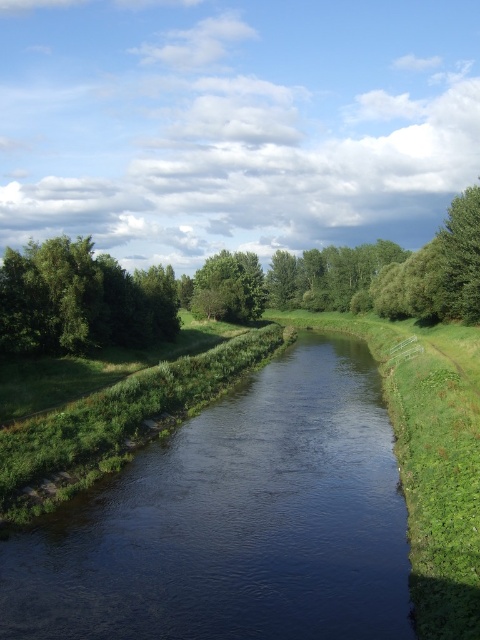
In the scene shown: Does dark water at center appear under green leafy tree at upper left?

Yes, dark water at center is below green leafy tree at upper left.

In the scene shown: Is dark water at center further to camera compared to green leafy tree at upper left?

No, it is not.

Locate an element on the screen. dark water at center is located at coordinates (235, 522).

Does green leafy tree at upper left appear on the right side of green leafy tree at left?

Indeed, green leafy tree at upper left is positioned on the right side of green leafy tree at left.

Based on the photo, does green leafy tree at upper left appear on the left side of green leafy tree at left?

In fact, green leafy tree at upper left is to the right of green leafy tree at left.

This screenshot has height=640, width=480. I want to click on green leafy tree at upper left, so click(230, 288).

The width and height of the screenshot is (480, 640). Find the location of `green leafy tree at upper left`. green leafy tree at upper left is located at coordinates 230,288.

Is green leafy tree at left smaller than green leafy tree at center?

Yes, green leafy tree at left is smaller than green leafy tree at center.

At what (x,y) coordinates should I click in order to perform the action: click on green leafy tree at left. Please return your answer as a coordinate pair (x, y). Looking at the image, I should click on (81, 300).